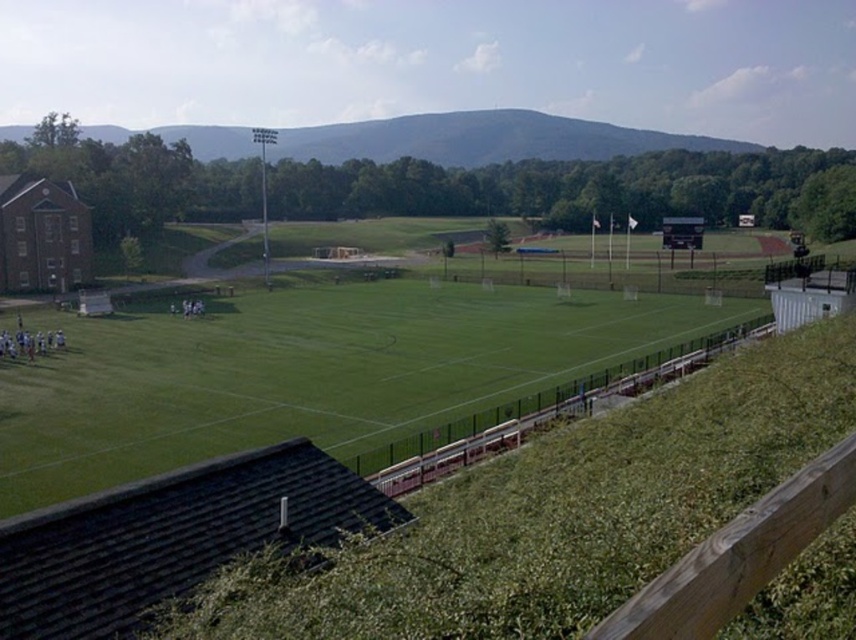
Can you confirm if green grass field at center is shorter than brick building at left?

Yes.

Does green grass field at center appear under brick building at left?

Yes.

Locate an element on the screen. green grass field at center is located at coordinates (306, 371).

The width and height of the screenshot is (856, 640). Identify the location of green grass field at center. (306, 371).